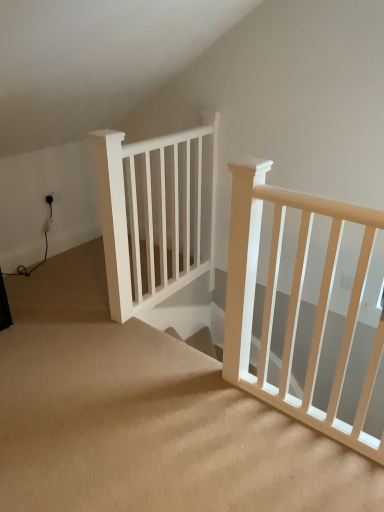
Where is `beige carpeted stairs at center`? This screenshot has height=512, width=384. beige carpeted stairs at center is located at coordinates (145, 416).

Measure the distance between point (165, 373) and camera.

Point (165, 373) and camera are 2.04 meters apart.

Describe the element at coordinates (145, 416) in the screenshot. This screenshot has height=512, width=384. I see `beige carpeted stairs at center` at that location.

Identify the location of white wooden rail at center. Image resolution: width=384 pixels, height=512 pixels. (151, 216).

Measure the distance between white wooden rail at center and camera.

A distance of 6.60 feet exists between white wooden rail at center and camera.

What do you see at coordinates (151, 216) in the screenshot?
I see `white wooden rail at center` at bounding box center [151, 216].

Measure the distance between point (153, 260) and camera.

Point (153, 260) is 2.59 meters away from camera.

This screenshot has height=512, width=384. I want to click on beige carpeted stairs at center, so click(x=145, y=416).

Would you say white wooden rail at center is to the left or to the right of beige carpeted stairs at center in the picture?

white wooden rail at center is to the right of beige carpeted stairs at center.

Between white wooden rail at center and beige carpeted stairs at center, which one is positioned in front?

beige carpeted stairs at center is in front.

Does point (138, 221) lie behind point (73, 322)?

Yes, it is behind point (73, 322).

From the image's perspective, is white wooden rail at center on beige carpeted stairs at center?

→ Yes, from the image's perspective, white wooden rail at center is on top of beige carpeted stairs at center.

From a real-world perspective, who is located higher, white wooden rail at center or beige carpeted stairs at center?

white wooden rail at center, from a real-world perspective.

Between white wooden rail at center and beige carpeted stairs at center, which one has larger width?

beige carpeted stairs at center is wider.

Which of these two, white wooden rail at center or beige carpeted stairs at center, stands taller?

white wooden rail at center.

Can you confirm if white wooden rail at center is bigger than beige carpeted stairs at center?

No, white wooden rail at center is not bigger than beige carpeted stairs at center.

Is beige carpeted stairs at center inside white wooden rail at center?

No.

In the scene shown: Are white wooden rail at center and beige carpeted stairs at center far apart?

No, white wooden rail at center is not far from beige carpeted stairs at center.

Is white wooden rail at center looking in the opposite direction of beige carpeted stairs at center?

No.

Identify the location of rail located on the right of beige carpeted stairs at center. Image resolution: width=384 pixels, height=512 pixels. (151, 216).

Does beige carpeted stairs at center appear on the left side of white wooden rail at center?

Correct, you'll find beige carpeted stairs at center to the left of white wooden rail at center.

In the scene shown: Considering their positions, is beige carpeted stairs at center located in front of or behind white wooden rail at center?

In the image, beige carpeted stairs at center appears in front of white wooden rail at center.

Does point (340, 482) come closer to viewer compared to point (116, 195)?

Yes.

From the image's perspective, is beige carpeted stairs at center above white wooden rail at center?

Incorrect, from the image's perspective, beige carpeted stairs at center is lower than white wooden rail at center.

From a real-world perspective, is beige carpeted stairs at center on white wooden rail at center?

No.

Can you confirm if beige carpeted stairs at center is thinner than white wooden rail at center?

Incorrect, the width of beige carpeted stairs at center is not less than that of white wooden rail at center.

Which of these two, beige carpeted stairs at center or white wooden rail at center, stands shorter?

Standing shorter between the two is beige carpeted stairs at center.

Which of these two, beige carpeted stairs at center or white wooden rail at center, is bigger?

beige carpeted stairs at center.

Consider the image. Is beige carpeted stairs at center not within white wooden rail at center?

Yes.

Is beige carpeted stairs at center next to white wooden rail at center and touching it?

There is a gap between beige carpeted stairs at center and white wooden rail at center.

Does beige carpeted stairs at center turn towards white wooden rail at center?

No, beige carpeted stairs at center is not aimed at white wooden rail at center.

At what (x,y) coordinates should I click in order to perform the action: click on stairs in front of the white wooden rail at center. Please return your answer as a coordinate pair (x, y). The height and width of the screenshot is (512, 384). Looking at the image, I should click on 145,416.

Locate an element on the screen. rail behind the beige carpeted stairs at center is located at coordinates (151, 216).

Locate an element on the screen. Image resolution: width=384 pixels, height=512 pixels. stairs below the white wooden rail at center (from the image's perspective) is located at coordinates (145, 416).